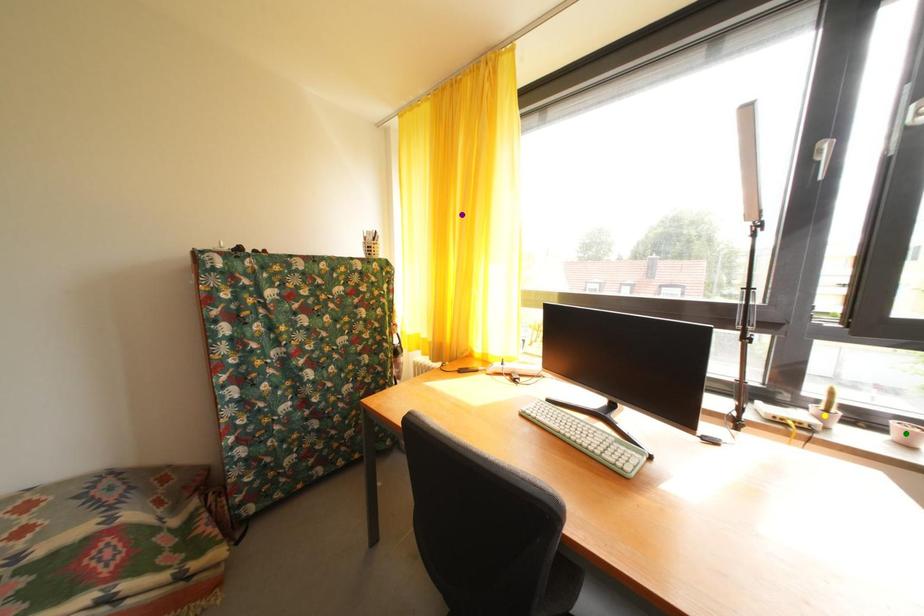
Order these from farthest to nearest:
A) purple point
B) yellow point
C) green point

purple point, yellow point, green point